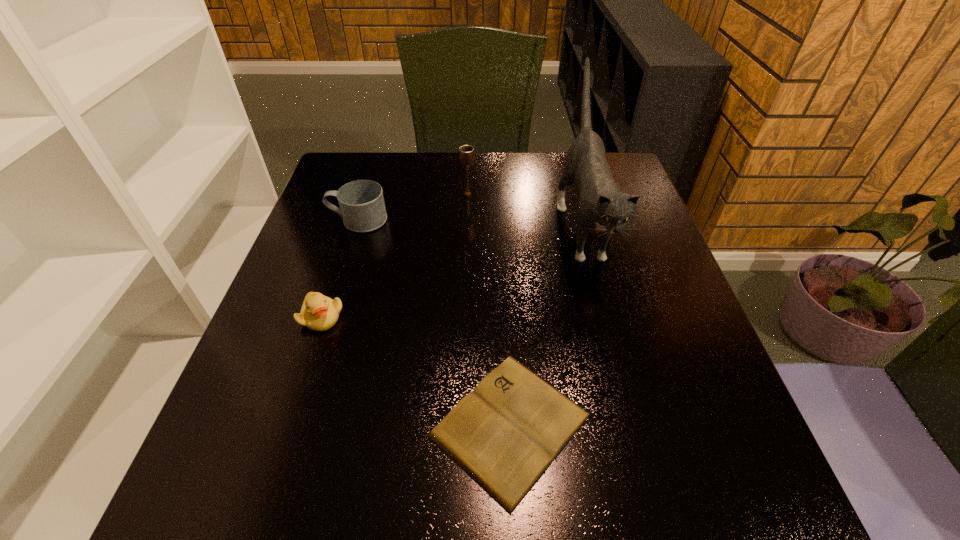
Where is `free spot between the mug and the duckling`? This screenshot has height=540, width=960. free spot between the mug and the duckling is located at coordinates (340, 268).

Locate an element on the screen. The image size is (960, 540). vacant space that's between the shortest object and the second nearest object is located at coordinates coord(416,371).

Identify the location of free area in between the chalice and the duckling. This screenshot has width=960, height=540. (395, 255).

I want to click on free space between the cat and the duckling, so coord(452,271).

At what (x,y) coordinates should I click in order to perform the action: click on vacant point located between the mug and the fourth shortest object. Please return your answer as a coordinate pair (x, y). Image resolution: width=960 pixels, height=540 pixels. Looking at the image, I should click on (413, 207).

Point out which object is positioned as the nearest to the cat. Please provide its 2D coordinates. Your answer should be formatted as a tuple, i.e. [(x, y)], where the tuple contains the x and y coordinates of a point satisfying the conditions above.

[(504, 434)]

Locate which object is the second closest to the second tallest object. Please provide its 2D coordinates. Your answer should be formatted as a tuple, i.e. [(x, y)], where the tuple contains the x and y coordinates of a point satisfying the conditions above.

[(602, 207)]

Image resolution: width=960 pixels, height=540 pixels. I want to click on vacant space that satisfies the following two spatial constraints: 1. on the side of the third tallest object with the handle; 2. on the back side of the nearest object, so click(x=294, y=425).

You are a GUI agent. You are given a task and a screenshot of the screen. Output one action in this format:
    pyautogui.click(x=<x>, y=<y>)
    Task: Click on the vacant space that satisfies the following two spatial constraints: 1. on the beak of the duckling; 2. on the left side of the shortest object
    This screenshot has height=540, width=960.
    Given the screenshot: What is the action you would take?
    pyautogui.click(x=286, y=425)

You are a GUI agent. You are given a task and a screenshot of the screen. Output one action in this format:
    pyautogui.click(x=<x>, y=<y>)
    Task: Click on the vacant point that satisfies the following two spatial constraints: 1. on the side of the shortest object with the handle; 2. on the right side of the mug
    Image resolution: width=960 pixels, height=540 pixels.
    Given the screenshot: What is the action you would take?
    pyautogui.click(x=294, y=425)